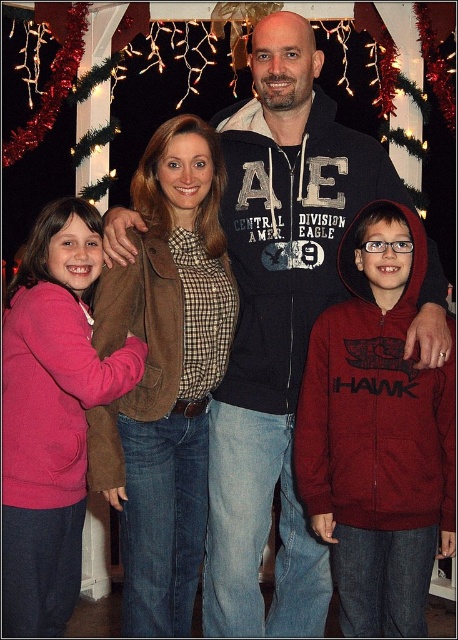
Question: Where is burgundy fleece hoodie at center located in relation to pink fleece sweater at left in the image?

Choices:
 (A) below
 (B) above

Answer: (A)

Question: Which point appears closest to the camera in this image?

Choices:
 (A) (14, 401)
 (B) (412, 476)

Answer: (B)

Question: Does burgundy fleece hoodie at center lie in front of pink fleece sweater at left?

Choices:
 (A) yes
 (B) no

Answer: (B)

Question: Which point is closer to the camera?

Choices:
 (A) (183, 257)
 (B) (58, 413)
 (C) (412, 454)

Answer: (C)

Question: Which point is closer to the camera?

Choices:
 (A) pink fleece sweater at left
 (B) burgundy fleece hoodie at center

Answer: (A)

Question: Is burgundy fleece hoodie at center closer to camera compared to pink fleece sweater at left?

Choices:
 (A) yes
 (B) no

Answer: (B)